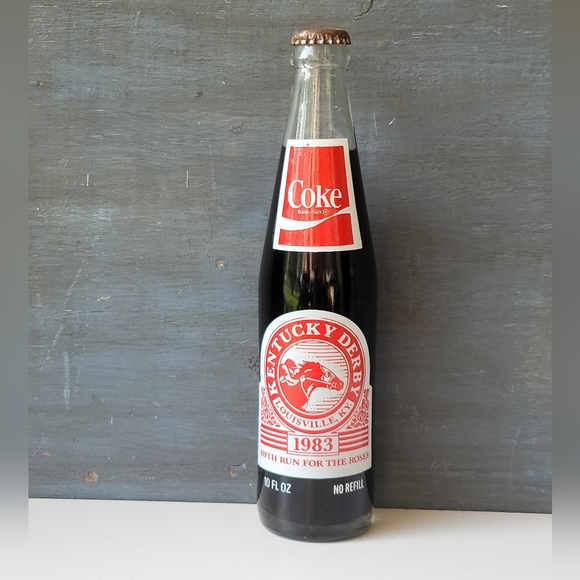
Identify the location of back wall grey. (456, 490).